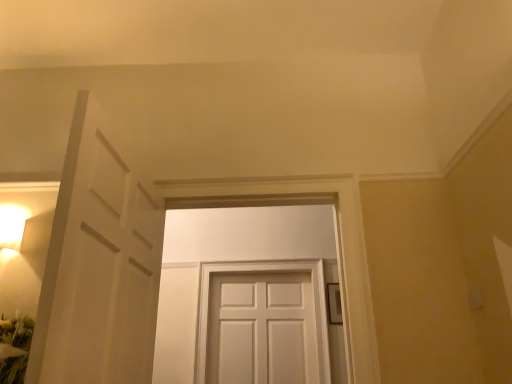
Question: Visually, is white matte door at center, the 2th door in the top-to-bottom sequence, positioned to the left or to the right of white matte door at center, the second door positioned from the back?

Choices:
 (A) left
 (B) right

Answer: (B)

Question: From the image's perspective, is white matte door at center, acting as the 1th door starting from the bottom, above or below white matte door at center, which is the 1th door from front to back?

Choices:
 (A) above
 (B) below

Answer: (B)

Question: Considering the positions of white matte door at center, the 2th door viewed from the front, and white matte door at center, the second door positioned from the back, in the image, is white matte door at center, the 2th door viewed from the front, wider or thinner than white matte door at center, the second door positioned from the back,?

Choices:
 (A) wide
 (B) thin

Answer: (B)

Question: Relative to white matte door at center, the 2th door in the top-to-bottom sequence, is white matte door at center, the second door positioned from the back, in front or behind?

Choices:
 (A) front
 (B) behind

Answer: (A)

Question: Looking at the image, does white matte door at center, the second door in the bottom-to-top sequence, seem bigger or smaller compared to white matte door at center, the 2th door in the top-to-bottom sequence?

Choices:
 (A) small
 (B) big

Answer: (B)

Question: From a real-world perspective, is white matte door at center, the second door in the bottom-to-top sequence, physically located above or below white matte door at center, which appears as the first door when viewed from the back?

Choices:
 (A) below
 (B) above

Answer: (B)

Question: Looking at their shapes, would you say white matte door at center, the 1th door from the top, is wider or thinner than white matte door at center, the 2th door in the top-to-bottom sequence?

Choices:
 (A) thin
 (B) wide

Answer: (B)